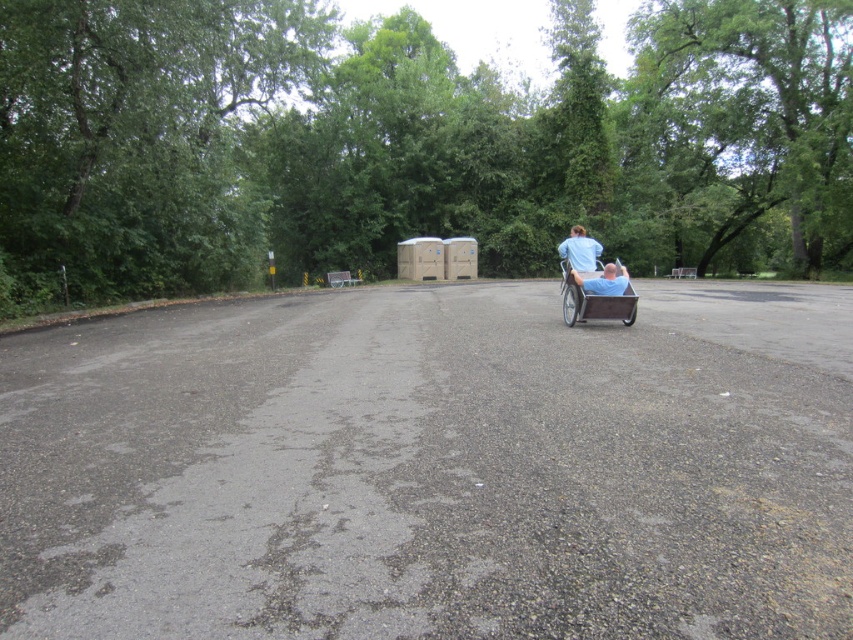
Question: Which object is positioned farthest from the wooden cart at right?

Choices:
 (A) blue fabric shirt at center
 (B) blue fabric person at center

Answer: (A)

Question: Does wooden cart at right have a greater width compared to blue fabric shirt at center?

Choices:
 (A) yes
 (B) no

Answer: (B)

Question: Which object is the closest to the wooden cart at right?

Choices:
 (A) blue fabric shirt at center
 (B) blue fabric person at center

Answer: (B)

Question: Which point is farther from the camera taking this photo?

Choices:
 (A) (583, 264)
 (B) (570, 273)
 (C) (613, 291)

Answer: (A)

Question: Is wooden cart at right bigger than blue fabric shirt at center?

Choices:
 (A) no
 (B) yes

Answer: (A)

Question: Is blue fabric shirt at center below blue fabric person at center?

Choices:
 (A) yes
 (B) no

Answer: (B)